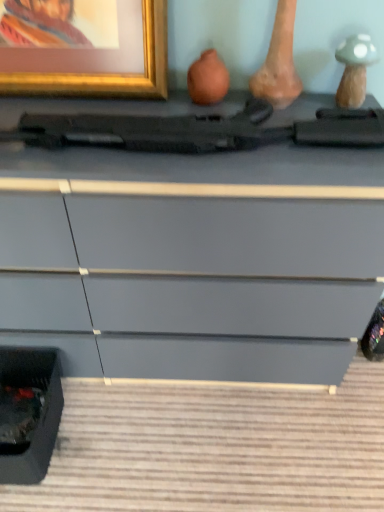
This screenshot has height=512, width=384. Find the location of `free space in front of matte gray chest of drawers at center`. free space in front of matte gray chest of drawers at center is located at coordinates (162, 446).